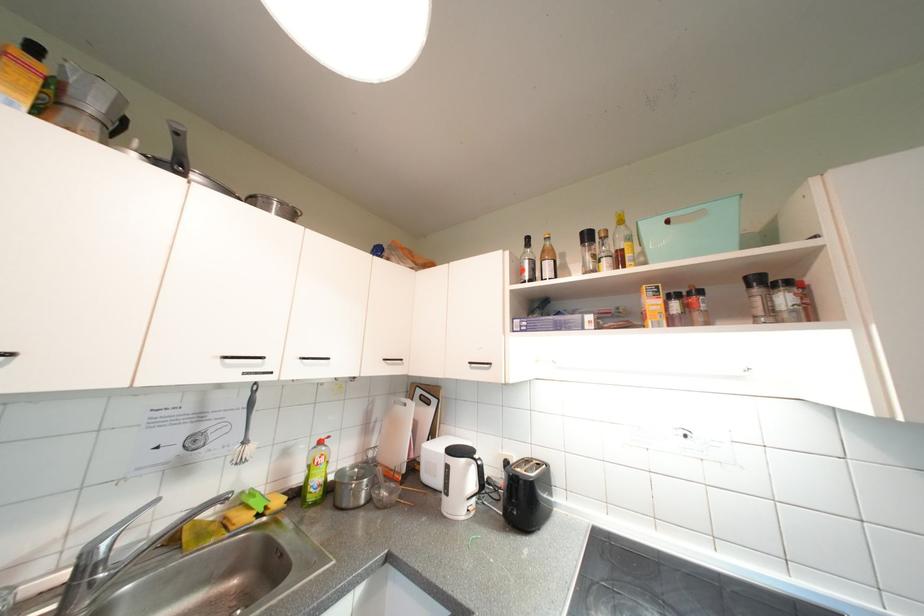
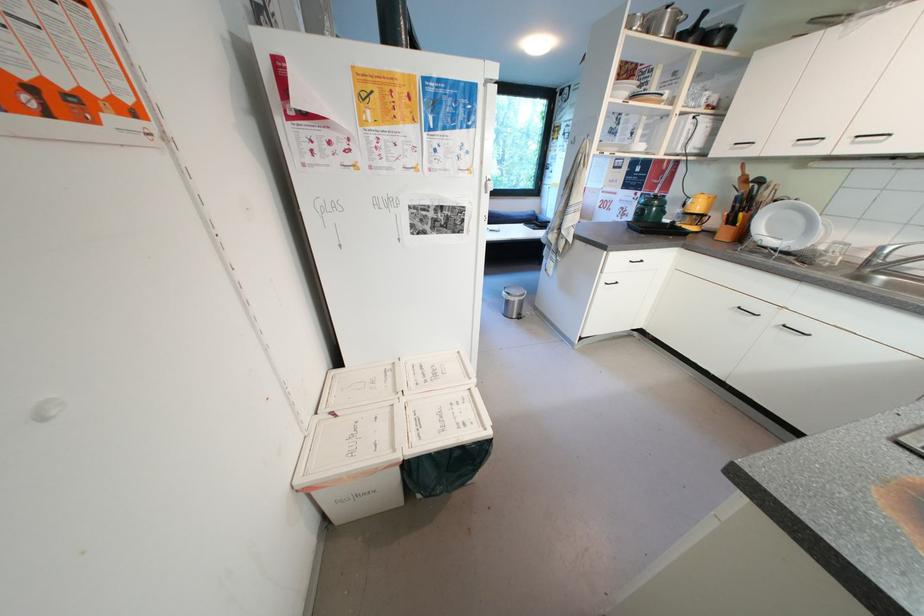
Locate, in the second image, the point that corresponds to (x=92, y=572) in the first image.

(883, 257)